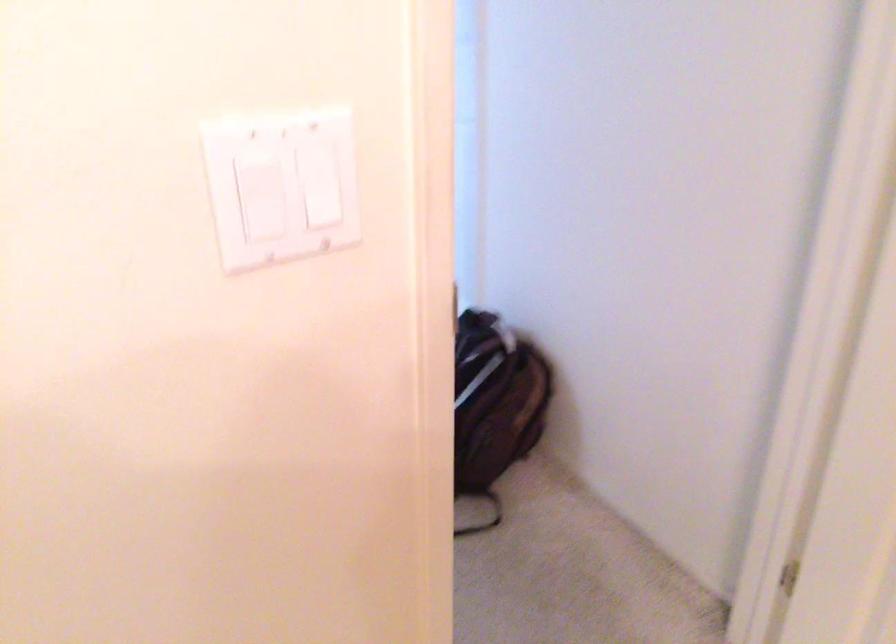
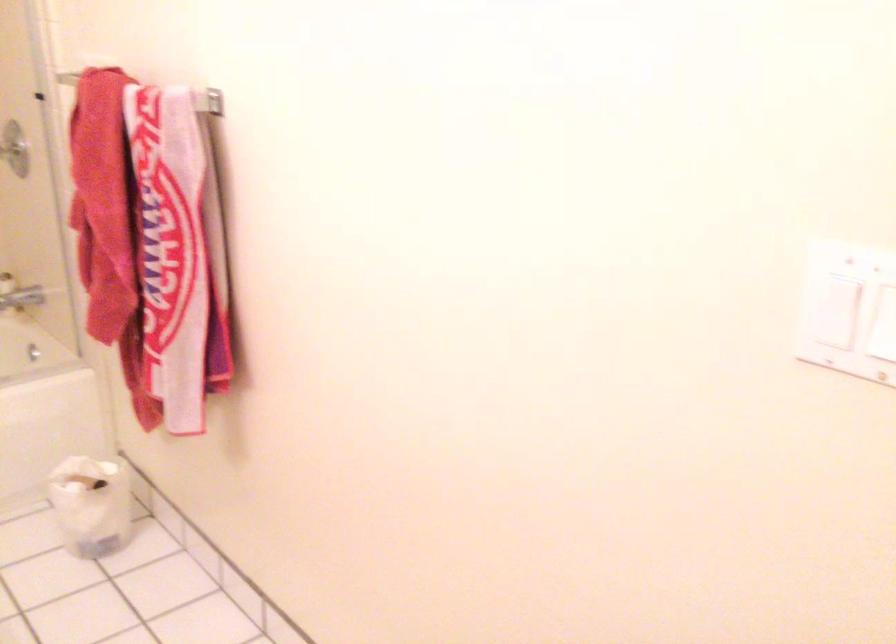
Question: I am providing you with two images of the same scene from different viewpoints. Please identify which objects are invisible in image2.

Choices:
 (A) chrome faucet handle
 (B) white light switch
 (C) small trash can
 (D) none of these

Answer: (D)